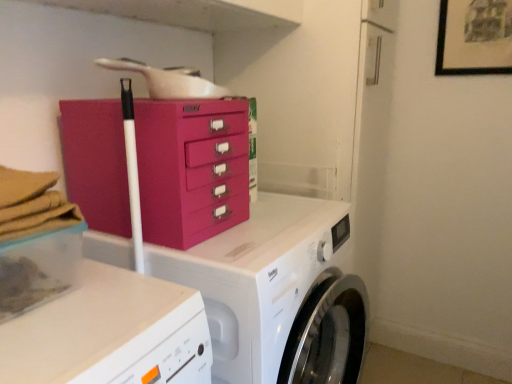
Locate an element on the screen. The width and height of the screenshot is (512, 384). black matte picture frame at upper right is located at coordinates (474, 37).

The image size is (512, 384). Find the location of `clear plastic container at lower left`. clear plastic container at lower left is located at coordinates (38, 269).

Is white glossy washing machine at center in contact with clear plastic container at lower left?

No, white glossy washing machine at center is not in contact with clear plastic container at lower left.

Is white glossy washing machine at center positioned in front of clear plastic container at lower left?

No.

Is clear plastic container at lower left inside white glossy washing machine at center?

No, white glossy washing machine at center does not contain clear plastic container at lower left.

Can you confirm if black matte picture frame at upper right is thinner than clear plastic container at lower left?

Yes, black matte picture frame at upper right is thinner than clear plastic container at lower left.

Is black matte picture frame at upper right smaller than clear plastic container at lower left?

Indeed, black matte picture frame at upper right has a smaller size compared to clear plastic container at lower left.

Can you confirm if black matte picture frame at upper right is positioned to the left of clear plastic container at lower left?

No.

Is clear plastic container at lower left taller or shorter than white glossy washing machine at center?

Considering their sizes, clear plastic container at lower left has less height than white glossy washing machine at center.

Would you consider clear plastic container at lower left to be distant from white glossy washing machine at center?

No, clear plastic container at lower left is in close proximity to white glossy washing machine at center.

Can you confirm if clear plastic container at lower left is wider than white glossy washing machine at center?

Incorrect, the width of clear plastic container at lower left does not surpass that of white glossy washing machine at center.

Considering the sizes of clear plastic container at lower left and white glossy washing machine at center in the image, is clear plastic container at lower left bigger or smaller than white glossy washing machine at center?

Considering their sizes, clear plastic container at lower left takes up less space than white glossy washing machine at center.

Is fuchsia plastic chest of drawers at center facing away from clear plastic container at lower left?

No, fuchsia plastic chest of drawers at center is not facing the opposite direction of clear plastic container at lower left.

Looking at this image, from the image's perspective, between fuchsia plastic chest of drawers at center and clear plastic container at lower left, which one is located above?

From the image's view, fuchsia plastic chest of drawers at center is above.

Is fuchsia plastic chest of drawers at center placed right next to clear plastic container at lower left?

No, fuchsia plastic chest of drawers at center is not in contact with clear plastic container at lower left.

From the image's perspective, is black matte picture frame at upper right above or below white glossy washing machine at center?

From the image's perspective, black matte picture frame at upper right appears above white glossy washing machine at center.

Who is taller, black matte picture frame at upper right or white glossy washing machine at center?

white glossy washing machine at center.

Is black matte picture frame at upper right positioned before white glossy washing machine at center?

No, it is not.

Who is smaller, black matte picture frame at upper right or white glossy washing machine at center?

Smaller between the two is black matte picture frame at upper right.

Do you think fuchsia plastic chest of drawers at center is within white glossy washing machine at center, or outside of it?

fuchsia plastic chest of drawers at center is not enclosed by white glossy washing machine at center.

Is fuchsia plastic chest of drawers at center bigger or smaller than white glossy washing machine at center?

Considering their sizes, fuchsia plastic chest of drawers at center takes up less space than white glossy washing machine at center.

In terms of width, does fuchsia plastic chest of drawers at center look wider or thinner when compared to white glossy washing machine at center?

Considering their sizes, fuchsia plastic chest of drawers at center looks slimmer than white glossy washing machine at center.

Is fuchsia plastic chest of drawers at center placed right next to white glossy washing machine at center?

No.

Which is more to the left, fuchsia plastic chest of drawers at center or black matte picture frame at upper right?

fuchsia plastic chest of drawers at center is more to the left.

Locate an element on the screen. the chest of drawers that is below the black matte picture frame at upper right (from the image's perspective) is located at coordinates tap(191, 168).

Considering the sizes of objects fuchsia plastic chest of drawers at center and black matte picture frame at upper right in the image provided, who is wider, fuchsia plastic chest of drawers at center or black matte picture frame at upper right?

fuchsia plastic chest of drawers at center.

Identify the location of washing machine directly beneath the clear plastic container at lower left (from a real-world perspective). Image resolution: width=512 pixels, height=384 pixels. (277, 293).

Locate an element on the screen. The image size is (512, 384). storage box that appears in front of the black matte picture frame at upper right is located at coordinates (38, 269).

Which object lies nearer to the anchor point clear plastic container at lower left, white glossy washing machine at center or fuchsia plastic chest of drawers at center?

The object closer to clear plastic container at lower left is fuchsia plastic chest of drawers at center.

Looking at the image, which one is located further to fuchsia plastic chest of drawers at center, black matte picture frame at upper right or clear plastic container at lower left?

black matte picture frame at upper right lies further to fuchsia plastic chest of drawers at center than the other object.

Based on their spatial positions, is clear plastic container at lower left or white glossy washing machine at center closer to fuchsia plastic chest of drawers at center?

The object closer to fuchsia plastic chest of drawers at center is white glossy washing machine at center.

Based on their spatial positions, is clear plastic container at lower left or white glossy washing machine at center further from black matte picture frame at upper right?

clear plastic container at lower left is positioned further to the anchor black matte picture frame at upper right.

When comparing their distances from clear plastic container at lower left, does fuchsia plastic chest of drawers at center or white glossy washing machine at center seem closer?

fuchsia plastic chest of drawers at center lies closer to clear plastic container at lower left than the other object.

When comparing their distances from clear plastic container at lower left, does white glossy washing machine at center or black matte picture frame at upper right seem closer?

white glossy washing machine at center.

Considering their positions, is black matte picture frame at upper right positioned closer to white glossy washing machine at center than fuchsia plastic chest of drawers at center?

The object closer to white glossy washing machine at center is fuchsia plastic chest of drawers at center.

From the image, which object appears to be farther from black matte picture frame at upper right, fuchsia plastic chest of drawers at center or clear plastic container at lower left?

clear plastic container at lower left is further to black matte picture frame at upper right.

Image resolution: width=512 pixels, height=384 pixels. Identify the location of washing machine between fuchsia plastic chest of drawers at center and black matte picture frame at upper right in the horizontal direction. (277, 293).

This screenshot has height=384, width=512. In order to click on storage box between fuchsia plastic chest of drawers at center and white glossy washing machine at center in the up-down direction in this screenshot , I will do `click(38, 269)`.

The image size is (512, 384). Find the location of `chest of drawers between clear plastic container at lower left and black matte picture frame at upper right from left to right`. chest of drawers between clear plastic container at lower left and black matte picture frame at upper right from left to right is located at coordinates (191, 168).

At what (x,y) coordinates should I click in order to perform the action: click on washing machine between clear plastic container at lower left and black matte picture frame at upper right from left to right. Please return your answer as a coordinate pair (x, y). Looking at the image, I should click on (277, 293).